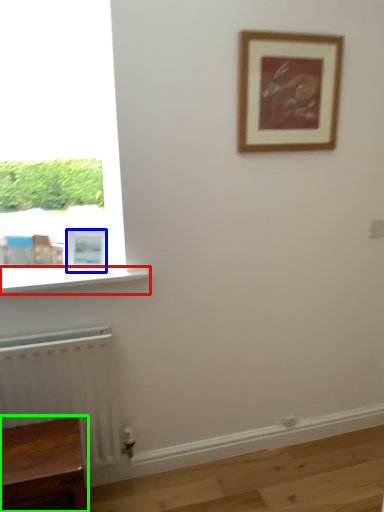
Question: Which object is the closest to the window sill (highlighted by a red box)? Choose among these: picture frame (highlighted by a blue box) or furniture (highlighted by a green box).

Choices:
 (A) picture frame
 (B) furniture

Answer: (A)